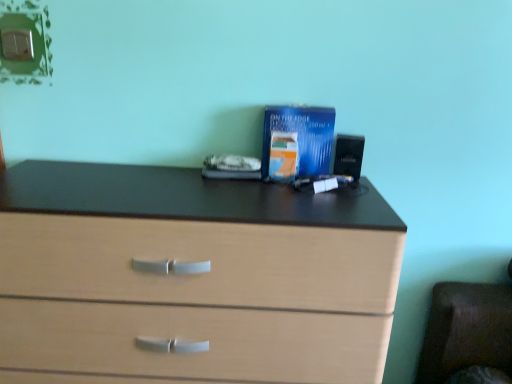
The image size is (512, 384). I want to click on vacant area on top of light wood chest of drawers at center (from a real-world perspective), so click(175, 187).